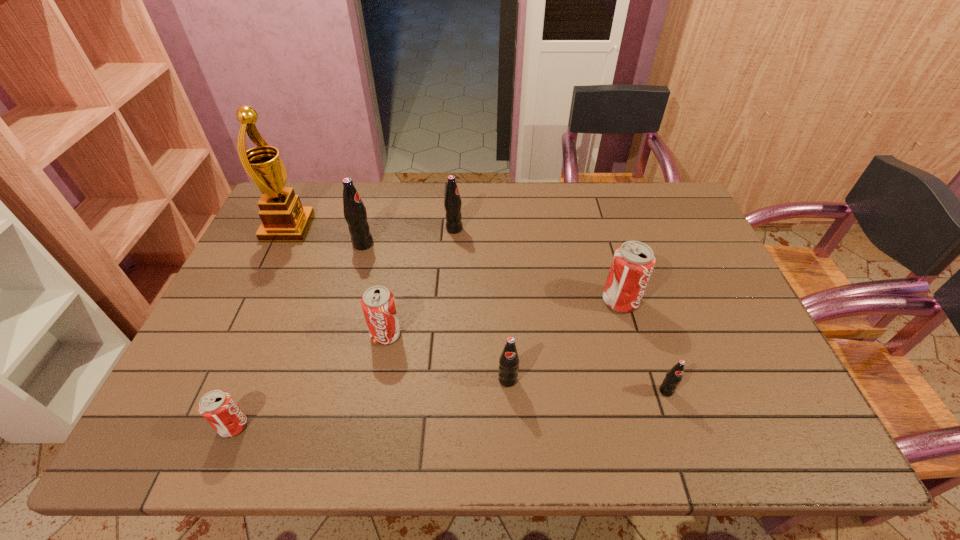
At what (x,y) coordinates should I click in order to perform the action: click on vacant area that lies between the second black pop from left to right and the leftmost pink soda can. Please return your answer as a coordinate pair (x, y). Looking at the image, I should click on (344, 327).

This screenshot has height=540, width=960. Find the location of `empty space between the leftmost pink soda can and the smallest black pop`. empty space between the leftmost pink soda can and the smallest black pop is located at coordinates (450, 408).

This screenshot has width=960, height=540. Find the location of `empty space between the smallest black pop and the fourth nearest object`. empty space between the smallest black pop and the fourth nearest object is located at coordinates (526, 363).

Locate an element on the screen. vacant space that's between the second smallest pink soda can and the rightmost black pop is located at coordinates (526, 363).

This screenshot has width=960, height=540. In order to click on object that is the fifth closest to the fifth soda can from left to right in this screenshot , I will do `click(219, 409)`.

Identify the location of object that is the second closest to the nearest object. (355, 214).

The width and height of the screenshot is (960, 540). Identify the location of soda can that is the second closest to the farthest pink soda can. (509, 360).

The image size is (960, 540). I want to click on the sixth closest soda can to the third object from left to right, so click(674, 376).

This screenshot has width=960, height=540. I want to click on the second closest black pop to the fifth nearest soda can, so click(x=509, y=360).

Identify which black pop is the closest to the leftmost black pop. Please provide its 2D coordinates. Your answer should be formatted as a tuple, i.e. [(x, y)], where the tuple contains the x and y coordinates of a point satisfying the conditions above.

[(452, 202)]